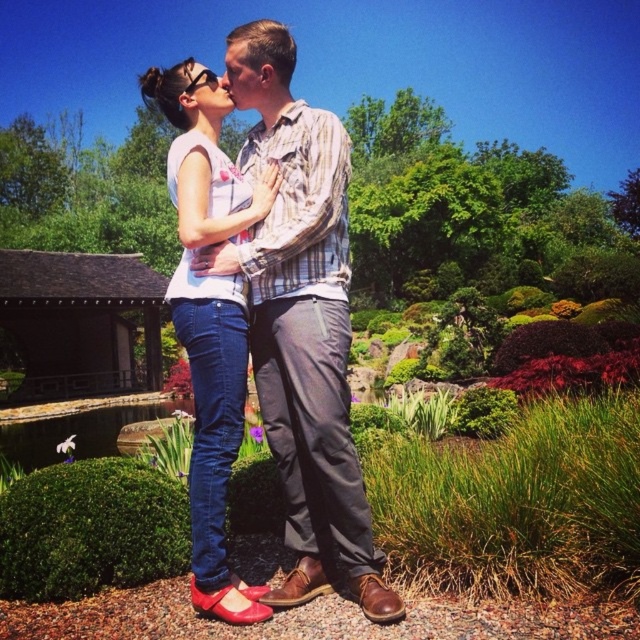
You are standing in the garden and see the point at coordinates (301, 324). What object is located at that point?

The point at coordinates (301, 324) corresponds to the brown leather shoes at center.

You are a photographer trying to capture a closeup of the brown leather shoes at center and the matte white blouse at center. Since you want to focus on both, which object should you adjust your camera focus to prioritize first?

The brown leather shoes at center is below the matte white blouse at center, so you should prioritize focusing on the matte white blouse at center first as it is closer to the camera.

You are a photographer trying to capture a closeup of the brown leather shoes at center and the matte white blouse at center. Since you want to focus on both objects equally, which one should you zoom in on more to ensure they appear the same size in the photo?

The brown leather shoes at center occupies less space than matte white blouse at center, so you should zoom in more on the brown leather shoes at center to make them appear the same size as the matte white blouse at center in the photo.